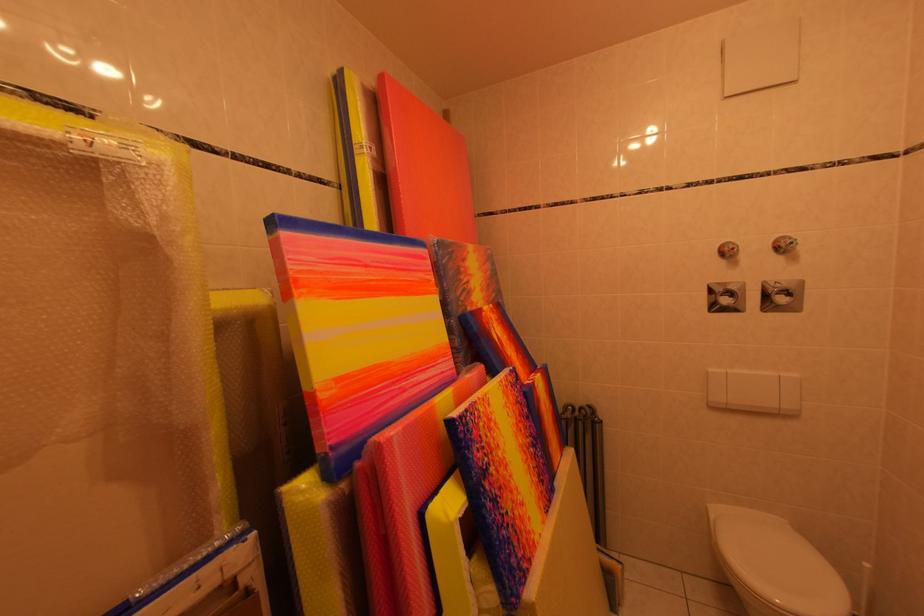
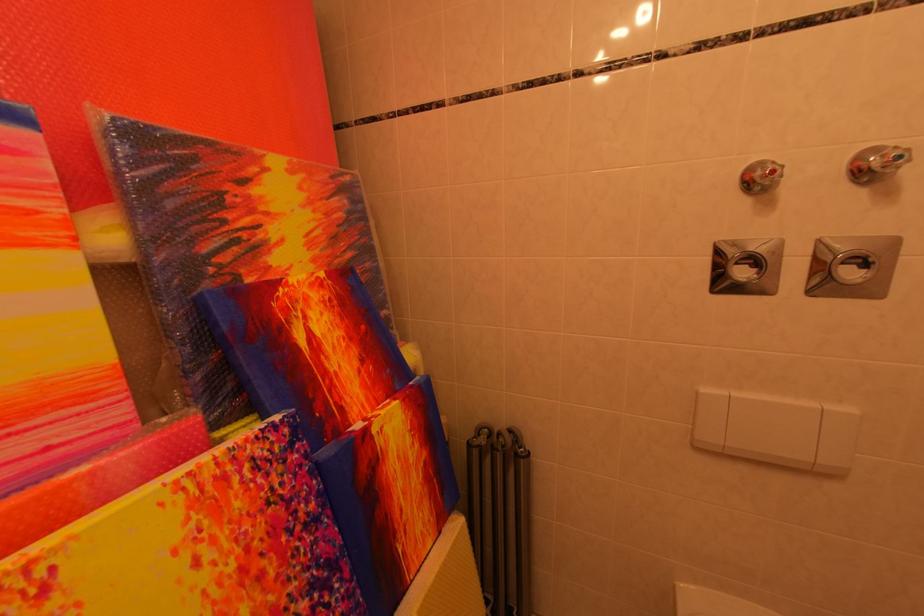
In the second image, find the point that corresponds to (469,284) in the first image.

(233, 225)